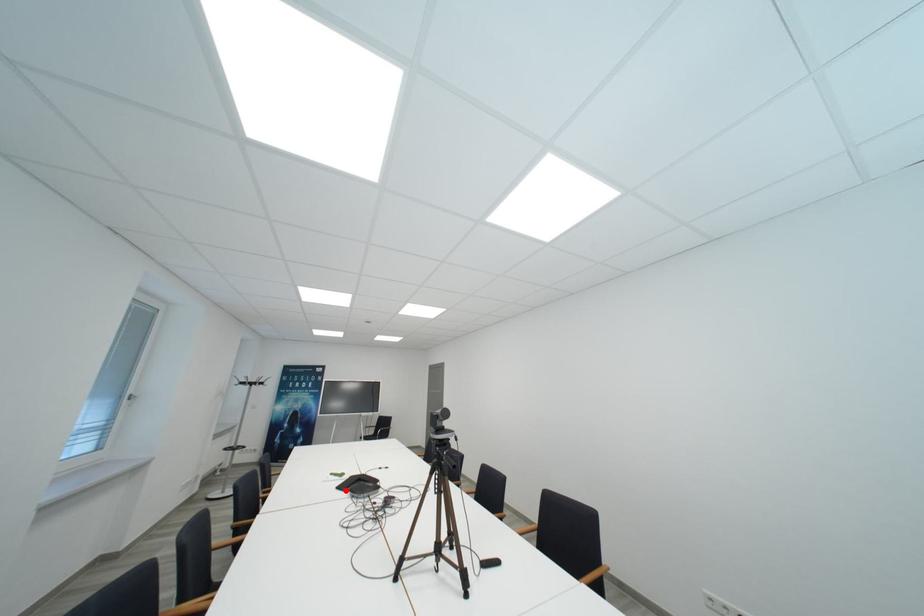
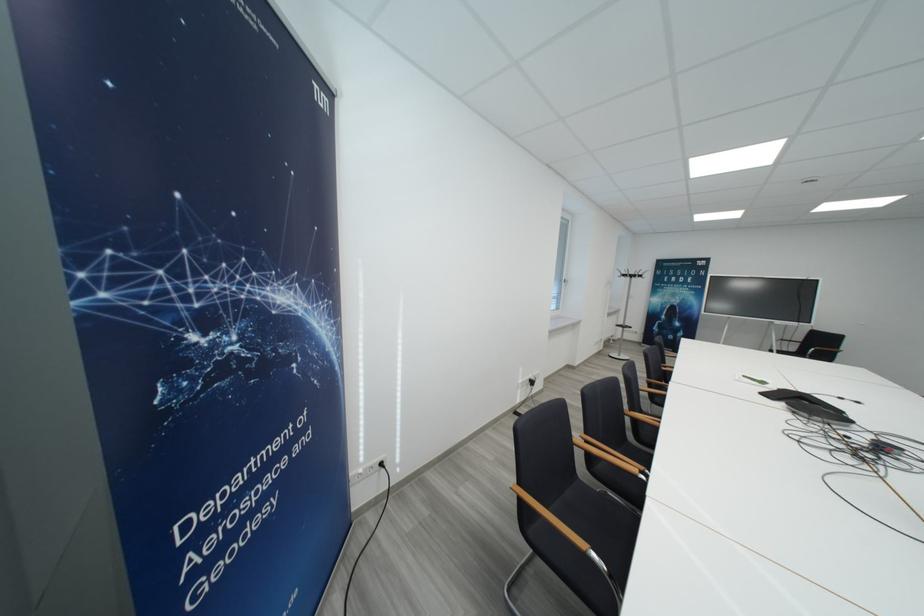
The point at the highlighted location is marked in the first image. Where is the corresponding point in the second image?

(770, 397)